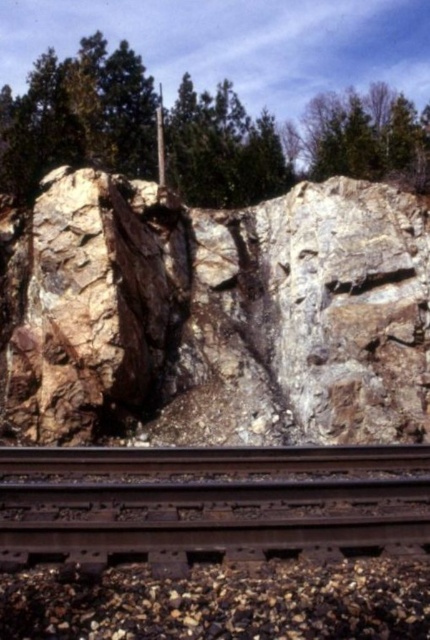
Question: Is rocky cliff at center further to camera compared to brown rusted metal train track at bottom?

Choices:
 (A) yes
 (B) no

Answer: (A)

Question: Is the position of rocky cliff at center more distant than that of green leafy tree at upper center?

Choices:
 (A) yes
 (B) no

Answer: (B)

Question: Estimate the real-world distances between objects in this image. Which object is farther from the green rough tree at upper center?

Choices:
 (A) green leafy tree at upper center
 (B) rocky cliff at center

Answer: (B)

Question: Which object is closer to the camera taking this photo?

Choices:
 (A) green rough tree at upper center
 (B) green leafy tree at upper center

Answer: (A)

Question: Is rocky cliff at center closer to the viewer compared to green rough tree at upper center?

Choices:
 (A) yes
 (B) no

Answer: (A)

Question: Which point is farther to the camera?

Choices:
 (A) (326, 170)
 (B) (132, 84)
 (C) (405, 364)
 (D) (159, 102)

Answer: (B)